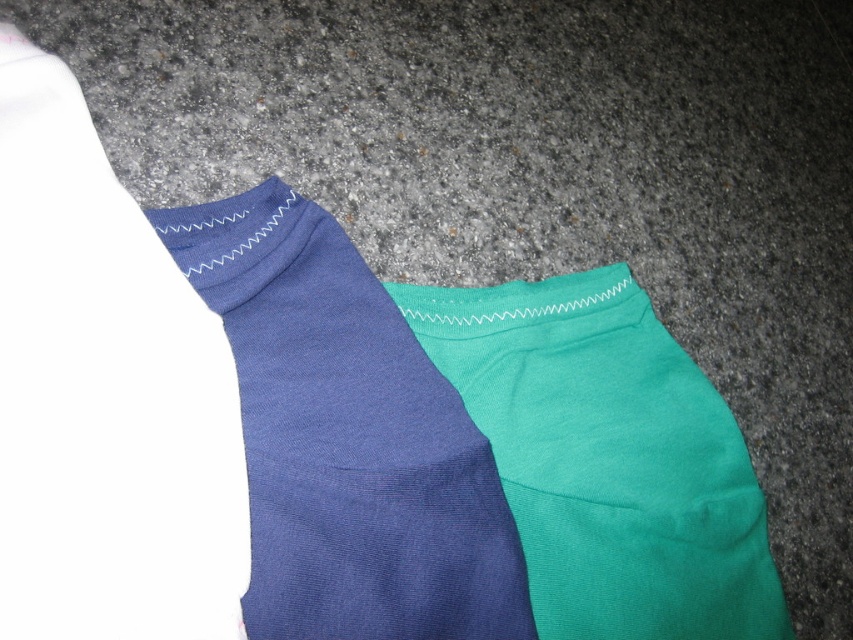
You are organizing a drawer and need to place the matte blue socks at center and the teal smooth shorts at center. Since the drawer has limited space, which item should you place first to maximize space efficiency?

The matte blue socks at center is smaller than the teal smooth shorts at center, so you should place the teal smooth shorts at center first to allow the smaller socks to fit into the remaining space.

From the picture: You are holding a 24 inch ruler and want to measure the distance from the camera to the point labeled point at (x=235, y=349). Based on the scene description, will your ruler be long enough to measure this distance?

The point labeled point at (x=235, y=349) is 24.78 inches from the camera. Since the ruler is only 24 inches long, it is slightly too short to measure the full distance. You would need a ruler at least 25 inches long to accurately measure it.